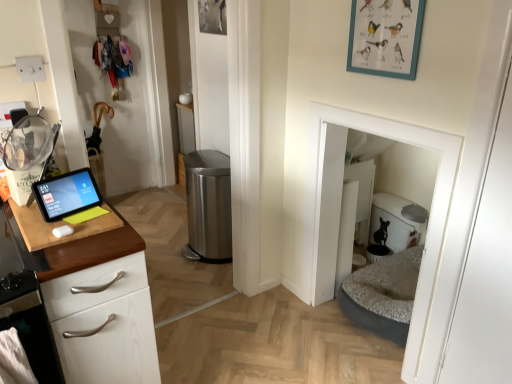
Question: Does polished stainless steel trash can at center have a larger size compared to wooden cutting board at left?

Choices:
 (A) no
 (B) yes

Answer: (B)

Question: Can you confirm if polished stainless steel trash can at center is positioned to the left of wooden cutting board at left?

Choices:
 (A) no
 (B) yes

Answer: (A)

Question: Is polished stainless steel trash can at center further to camera compared to wooden cutting board at left?

Choices:
 (A) yes
 (B) no

Answer: (A)

Question: Is wooden cutting board at left located within polished stainless steel trash can at center?

Choices:
 (A) yes
 (B) no

Answer: (B)

Question: From the image's perspective, does polished stainless steel trash can at center appear lower than wooden cutting board at left?

Choices:
 (A) no
 (B) yes

Answer: (B)

Question: Considering the relative sizes of polished stainless steel trash can at center and wooden cutting board at left in the image provided, is polished stainless steel trash can at center wider than wooden cutting board at left?

Choices:
 (A) no
 (B) yes

Answer: (A)

Question: Considering the relative sizes of white matte door at center and polished stainless steel trash can at center in the image provided, is white matte door at center smaller than polished stainless steel trash can at center?

Choices:
 (A) no
 (B) yes

Answer: (B)

Question: Considering the relative positions of white matte door at center and polished stainless steel trash can at center in the image provided, is white matte door at center to the left of polished stainless steel trash can at center from the viewer's perspective?

Choices:
 (A) no
 (B) yes

Answer: (A)

Question: Can you confirm if white matte door at center is wider than polished stainless steel trash can at center?

Choices:
 (A) yes
 (B) no

Answer: (B)

Question: From the image's perspective, is white matte door at center under polished stainless steel trash can at center?

Choices:
 (A) yes
 (B) no

Answer: (A)

Question: Does white matte door at center have a lesser width compared to polished stainless steel trash can at center?

Choices:
 (A) yes
 (B) no

Answer: (A)

Question: Is white matte door at center bigger than polished stainless steel trash can at center?

Choices:
 (A) yes
 (B) no

Answer: (B)

Question: Is wooden cutting board at left taller than polished stainless steel trash can at center?

Choices:
 (A) yes
 (B) no

Answer: (B)